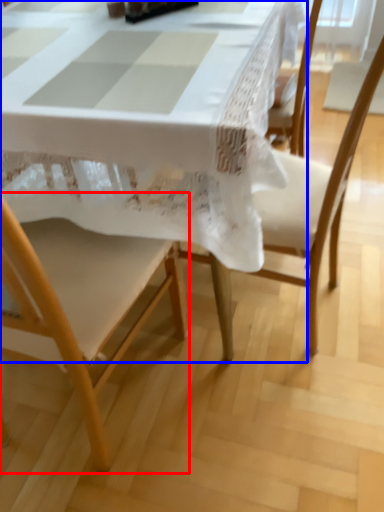
Question: Which of the following is the closest to the observer, chair (highlighted by a red box) or table (highlighted by a blue box)?

Choices:
 (A) chair
 (B) table

Answer: (A)